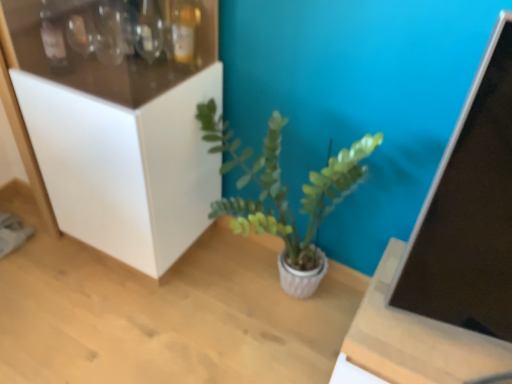
Question: Considering the relative sizes of white matte cabinet at left and green matte plant at center in the image provided, is white matte cabinet at left taller than green matte plant at center?

Choices:
 (A) no
 (B) yes

Answer: (B)

Question: From a real-world perspective, is white matte cabinet at left on top of green matte plant at center?

Choices:
 (A) yes
 (B) no

Answer: (A)

Question: Is white matte cabinet at left outside green matte plant at center?

Choices:
 (A) no
 (B) yes

Answer: (B)

Question: From the image's perspective, does white matte cabinet at left appear higher than green matte plant at center?

Choices:
 (A) no
 (B) yes

Answer: (B)

Question: Would you say green matte plant at center is part of white matte cabinet at left's contents?

Choices:
 (A) yes
 (B) no

Answer: (B)

Question: Does white matte cabinet at left come in front of green matte plant at center?

Choices:
 (A) no
 (B) yes

Answer: (B)

Question: Is wooden table at center closer to camera compared to white matte cabinet at left?

Choices:
 (A) no
 (B) yes

Answer: (B)

Question: From a real-world perspective, does wooden table at center sit lower than white matte cabinet at left?

Choices:
 (A) yes
 (B) no

Answer: (A)

Question: Considering the relative sizes of wooden table at center and white matte cabinet at left in the image provided, is wooden table at center bigger than white matte cabinet at left?

Choices:
 (A) yes
 (B) no

Answer: (B)

Question: Is the depth of wooden table at center greater than that of white matte cabinet at left?

Choices:
 (A) yes
 (B) no

Answer: (B)

Question: Can you confirm if wooden table at center is wider than white matte cabinet at left?

Choices:
 (A) yes
 (B) no

Answer: (A)

Question: Does wooden table at center have a lesser height compared to white matte cabinet at left?

Choices:
 (A) no
 (B) yes

Answer: (B)

Question: Does wooden table at center have a lesser width compared to green matte plant at center?

Choices:
 (A) yes
 (B) no

Answer: (B)